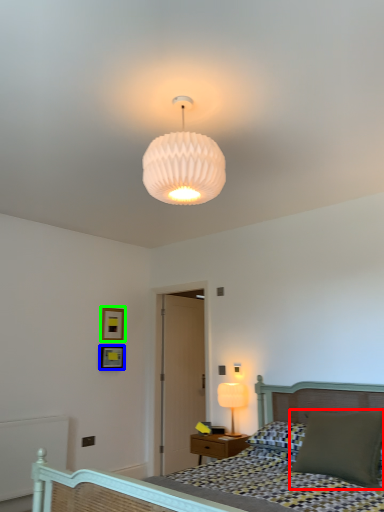
Question: Estimate the real-world distances between objects in this image. Which object is closer to pillow (highlighted by a red box), picture frame (highlighted by a blue box) or picture frame (highlighted by a green box)?

Choices:
 (A) picture frame
 (B) picture frame

Answer: (A)